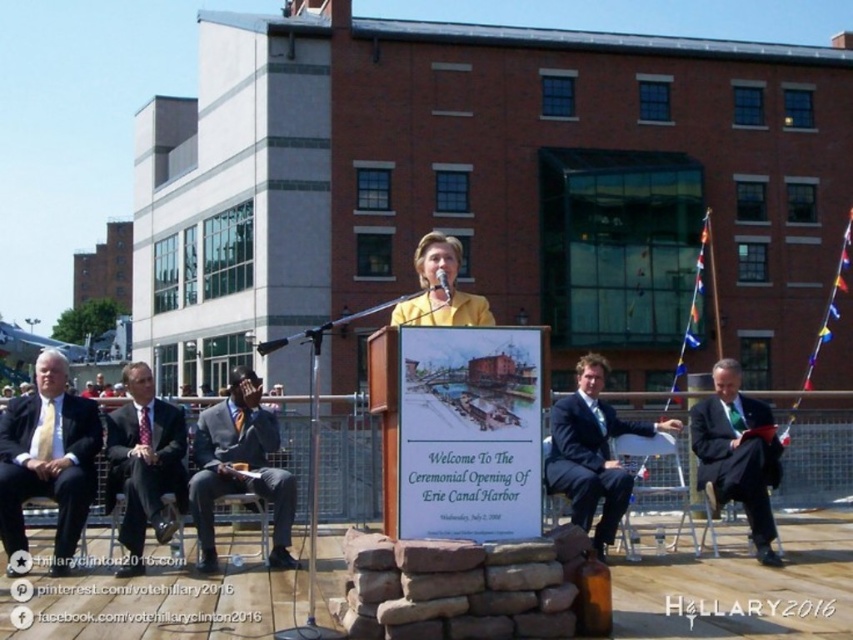
In the scene shown: Is matte gold tie at left bigger than dark blue suit at center?

Correct, matte gold tie at left is larger in size than dark blue suit at center.

Between matte gold tie at left and dark blue suit at center, which one is positioned higher?

Positioned higher is dark blue suit at center.

Is point (67, 406) positioned behind point (563, 429)?

No, it is in front of (563, 429).

I want to click on matte gold tie at left, so click(48, 458).

Between dark suit at center and black plastic microphone at center, which one is positioned lower?

dark suit at center is below.

Is point (727, 410) positioned behind point (438, 284)?

Yes, it is behind point (438, 284).

Is point (767, 413) positioned in front of point (445, 300)?

No, (767, 413) is behind (445, 300).

This screenshot has width=853, height=640. Find the location of `dark suit at center`. dark suit at center is located at coordinates (737, 454).

Does dark suit at center appear under yellow matte jacket at center?

Indeed, dark suit at center is positioned under yellow matte jacket at center.

Between dark suit at center and yellow matte jacket at center, which one has less height?

dark suit at center

Which is behind, point (734, 424) or point (415, 266)?

Positioned behind is point (415, 266).

Locate an element on the screen. The image size is (853, 640). dark suit at center is located at coordinates (737, 454).